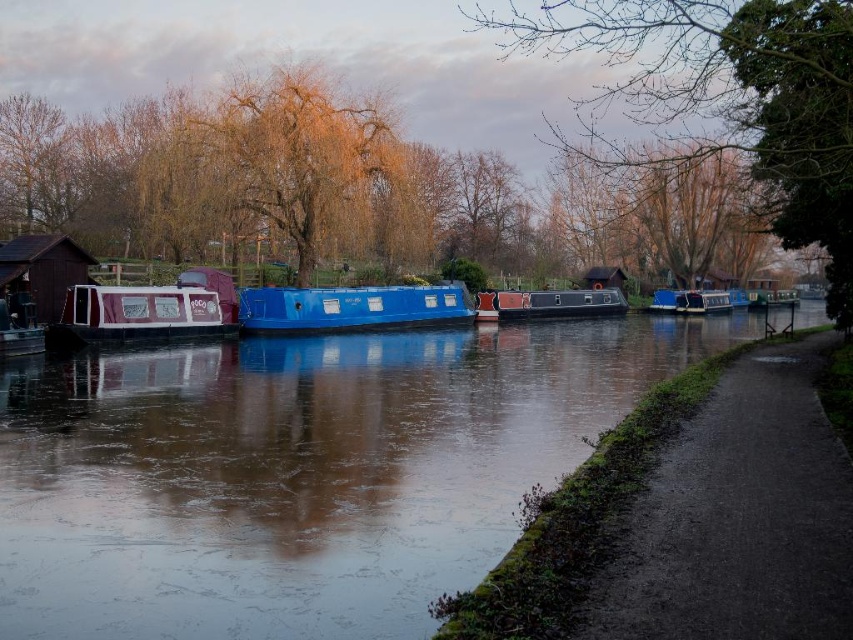
The height and width of the screenshot is (640, 853). What do you see at coordinates (558, 304) in the screenshot?
I see `matte black barge at center` at bounding box center [558, 304].

Can you confirm if matte black barge at center is positioned above blue glossy houseboat at center?

Actually, matte black barge at center is below blue glossy houseboat at center.

Who is more forward, (527,291) or (715,296)?

Point (527,291)

Find the location of a particular element. The image size is (853, 640). matte black barge at center is located at coordinates (558, 304).

Which is behind, point (32, 624) or point (724, 298)?

The point (724, 298) is behind.

Locate an element on the screen. Image resolution: width=853 pixels, height=640 pixels. glossy blue water at center is located at coordinates (299, 472).

Is glossy blue water at center below matte black barge at center?

Yes.

Is glossy blue water at center taller than matte black barge at center?

In fact, glossy blue water at center may be shorter than matte black barge at center.

Which is in front, point (426, 528) or point (596, 308)?

Positioned in front is point (426, 528).

You are a GUI agent. You are given a task and a screenshot of the screen. Output one action in this format:
    pyautogui.click(x=<x>, y=<y>)
    Task: Click on the glossy blue water at center
    This screenshot has height=640, width=853.
    Given the screenshot: What is the action you would take?
    pyautogui.click(x=299, y=472)